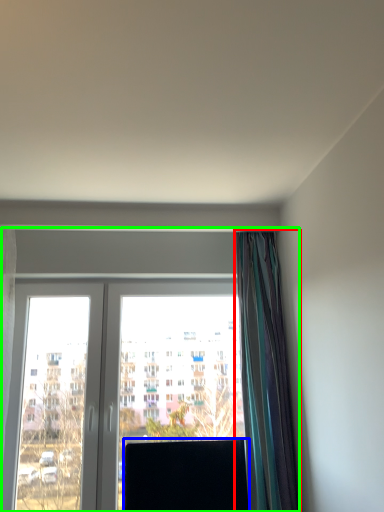
Question: Which object is the closest to the curtain (highlighted by a red box)? Choose among these: window screen (highlighted by a blue box) or window (highlighted by a green box).

Choices:
 (A) window screen
 (B) window

Answer: (B)